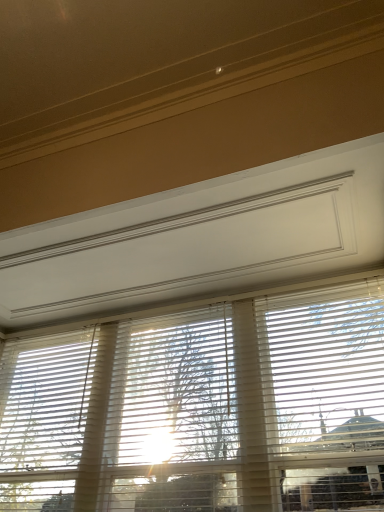
Question: Is white matte blinds at center shorter than translucent wood tree at center?

Choices:
 (A) yes
 (B) no

Answer: (B)

Question: Is white matte blinds at center behind translucent wood tree at center?

Choices:
 (A) no
 (B) yes

Answer: (A)

Question: Considering the relative positions of white matte blinds at center and translucent wood tree at center in the image provided, is white matte blinds at center to the right of translucent wood tree at center from the viewer's perspective?

Choices:
 (A) no
 (B) yes

Answer: (A)

Question: From the image's perspective, is white matte blinds at center under translucent wood tree at center?

Choices:
 (A) yes
 (B) no

Answer: (A)

Question: From the image's perspective, does white matte blinds at center appear higher than translucent wood tree at center?

Choices:
 (A) no
 (B) yes

Answer: (A)

Question: From a real-world perspective, is white matte blinds at center positioned above or below white matte blinds at right?

Choices:
 (A) below
 (B) above

Answer: (B)

Question: Is white matte blinds at center to the left or to the right of white matte blinds at right in the image?

Choices:
 (A) right
 (B) left

Answer: (B)

Question: Relative to white matte blinds at right, is white matte blinds at center in front or behind?

Choices:
 (A) front
 (B) behind

Answer: (A)

Question: Is white matte blinds at center inside the boundaries of white matte blinds at right, or outside?

Choices:
 (A) inside
 (B) outside

Answer: (B)

Question: From a real-world perspective, is translucent wood tree at center positioned above or below white matte blinds at center?

Choices:
 (A) below
 (B) above

Answer: (A)

Question: Looking at the image, does translucent wood tree at center seem bigger or smaller compared to white matte blinds at center?

Choices:
 (A) big
 (B) small

Answer: (B)

Question: Would you say translucent wood tree at center is inside or outside white matte blinds at center?

Choices:
 (A) inside
 (B) outside

Answer: (A)

Question: Would you say translucent wood tree at center is to the left or to the right of white matte blinds at center in the picture?

Choices:
 (A) left
 (B) right

Answer: (B)

Question: In terms of width, does white matte blinds at right look wider or thinner when compared to white matte blinds at center?

Choices:
 (A) thin
 (B) wide

Answer: (B)

Question: Choose the correct answer: Is white matte blinds at right inside white matte blinds at center or outside it?

Choices:
 (A) outside
 (B) inside

Answer: (B)